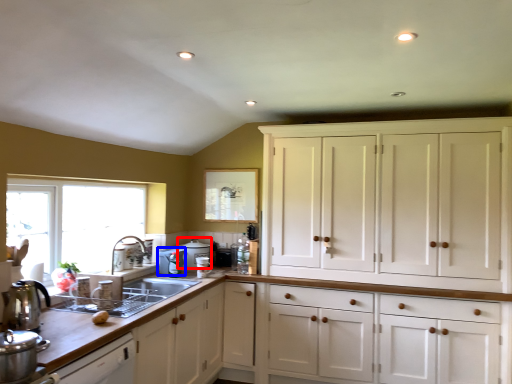
Question: Among these objects, which one is nearest to the camera, appliance (highlighted by a red box) or appliance (highlighted by a blue box)?

Choices:
 (A) appliance
 (B) appliance

Answer: (B)